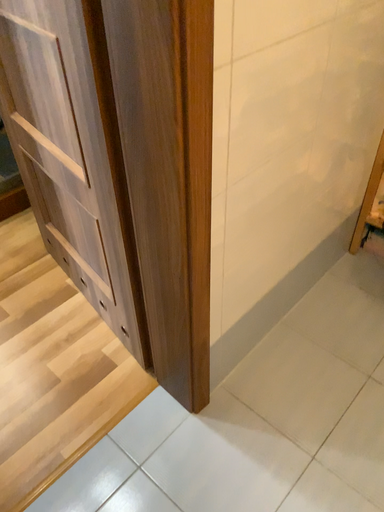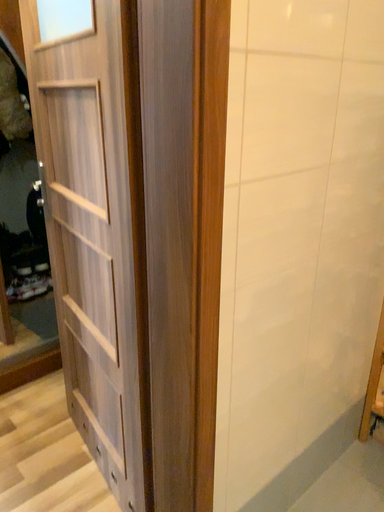
Question: How did the camera likely rotate when shooting the video?

Choices:
 (A) rotated downward
 (B) rotated upward

Answer: (B)